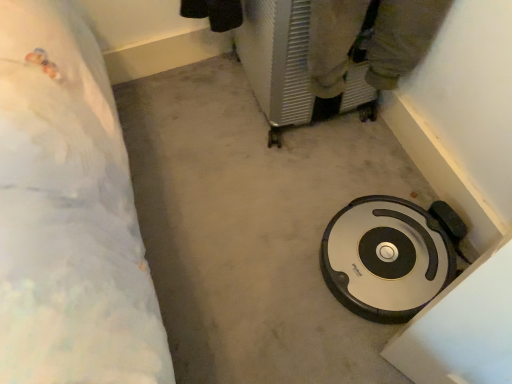
Find the location of a particular element. This screenshot has height=384, width=512. gray concrete at center is located at coordinates (253, 228).

In order to face gray concrete at center, should I rotate leftwards or rightwards?

Rotate your view right by about 0.870°.

The height and width of the screenshot is (384, 512). Describe the element at coordinates (253, 228) in the screenshot. I see `gray concrete at center` at that location.

Where is `gray concrete at center`? Image resolution: width=512 pixels, height=384 pixels. gray concrete at center is located at coordinates [253, 228].